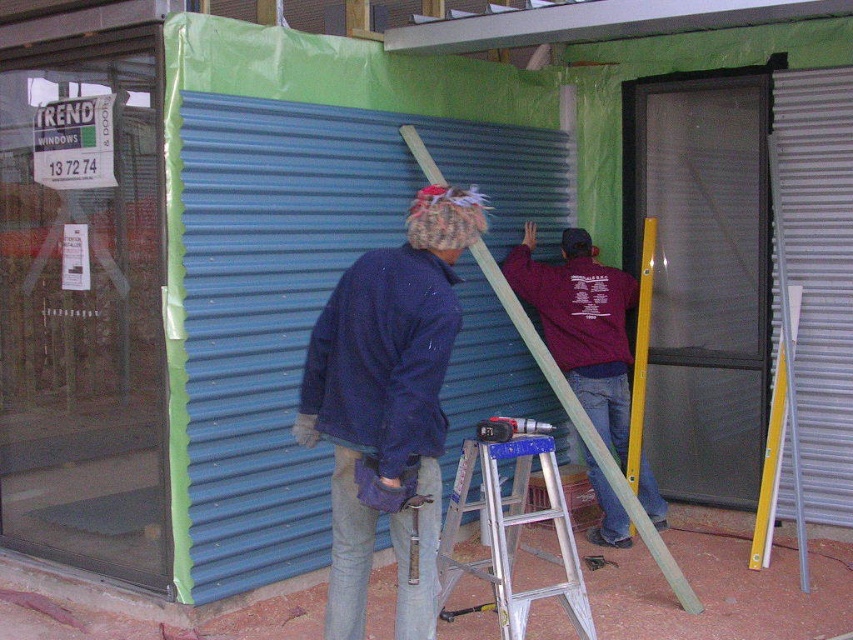
Question: Which point is farther to the camera?

Choices:
 (A) dark blue fabric at center
 (B) metallic silver shutter at right
 (C) silver metallic ladder at center

Answer: (B)

Question: Is dark blue fleece at center thinner than yellow metallic ladder at right?

Choices:
 (A) yes
 (B) no

Answer: (B)

Question: Among these objects, which one is farthest from the camera?

Choices:
 (A) yellow metallic ladder at center
 (B) yellow metallic ladder at right
 (C) silver metallic ladder at center

Answer: (B)

Question: Does metallic silver shutter at right appear on the left side of metallic blue drill at center?

Choices:
 (A) no
 (B) yes

Answer: (A)

Question: Which of the following is the farthest from the observer?

Choices:
 (A) metallic hammer at center
 (B) yellow metallic ladder at center

Answer: (B)

Question: Observing the image, what is the correct spatial positioning of dark blue fabric at center in reference to dark blue fleece at center?

Choices:
 (A) left
 (B) right

Answer: (A)